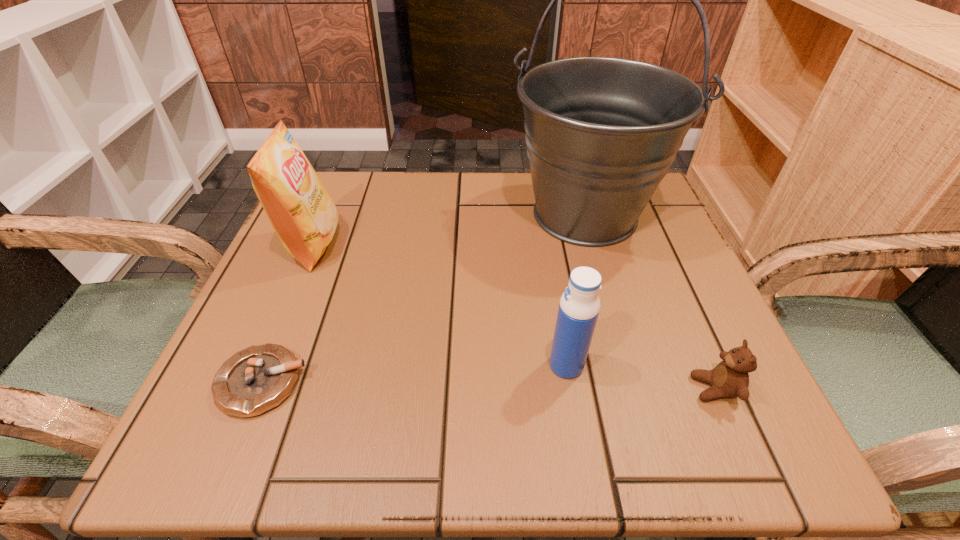
You are a GUI agent. You are given a task and a screenshot of the screen. Output one action in this format:
    pyautogui.click(x=<x>, y=<y>)
    Task: Click on the free spot between the fourth shortest object and the second shortest object
    
    Given the screenshot: What is the action you would take?
    pyautogui.click(x=514, y=317)

Image resolution: width=960 pixels, height=540 pixels. In order to click on vacant region between the shortest object and the teddy bear in this screenshot , I will do `click(489, 386)`.

The image size is (960, 540). What are the coordinates of `free spot between the tallest object and the shortest object` in the screenshot? It's located at (423, 298).

You are a GUI agent. You are given a task and a screenshot of the screen. Output one action in this format:
    pyautogui.click(x=<x>, y=<y>)
    Task: Click on the free space between the second tallest object and the bucket
    
    Given the screenshot: What is the action you would take?
    pyautogui.click(x=449, y=230)

You are a GUI agent. You are given a task and a screenshot of the screen. Output one action in this format:
    pyautogui.click(x=<x>, y=<y>)
    Task: Click on the vacant area between the fourth tallest object and the ashtray
    The width and height of the screenshot is (960, 540).
    Given the screenshot: What is the action you would take?
    pyautogui.click(x=489, y=386)

Where is `empty space that is in between the second shortest object and the ashtray`? This screenshot has width=960, height=540. empty space that is in between the second shortest object and the ashtray is located at coordinates (489, 386).

Locate an element on the screen. The image size is (960, 540). vacant area between the second shortest object and the bucket is located at coordinates (650, 301).

Find the location of a particular element. free spot between the bucket and the second tallest object is located at coordinates (449, 230).

Identify the location of vacant space in between the crisp (potato chip) and the ashtray. The image size is (960, 540). (288, 314).

The width and height of the screenshot is (960, 540). I want to click on vacant area between the third shortest object and the fourth tallest object, so click(x=640, y=377).